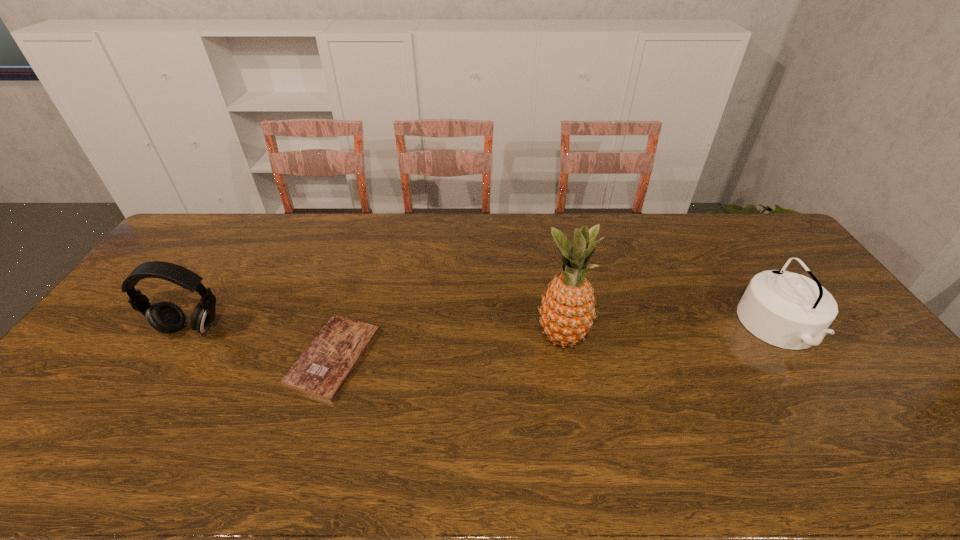
What are the coordinates of `free region that satisfies the following two spatial constraints: 1. on the spout of the kettle; 2. on the ear cups of the third shortest object` in the screenshot? It's located at (781, 329).

At what (x,y) coordinates should I click in order to perform the action: click on free region that satisfies the following two spatial constraints: 1. on the spout of the kettle; 2. on the ear cups of the earphone. Please return your answer as a coordinate pair (x, y). This screenshot has height=540, width=960. Looking at the image, I should click on (781, 329).

Find the location of a particular element. This screenshot has height=540, width=960. vacant space that satisfies the following two spatial constraints: 1. on the spout of the rightmost object; 2. on the ear cups of the earphone is located at coordinates (781, 329).

The width and height of the screenshot is (960, 540). Identify the location of free location that satisfies the following two spatial constraints: 1. on the ear cups of the pineapple; 2. on the left side of the third shortest object. (185, 337).